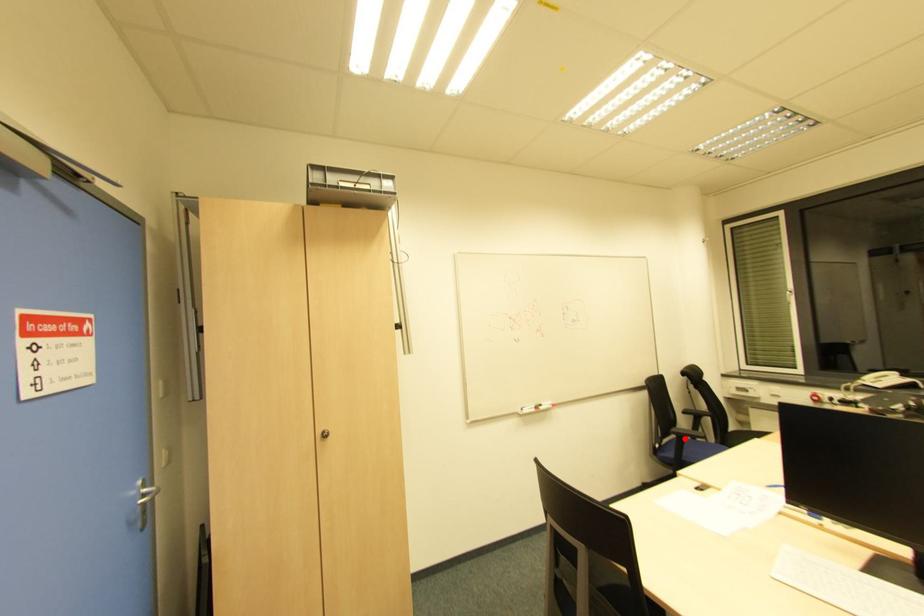
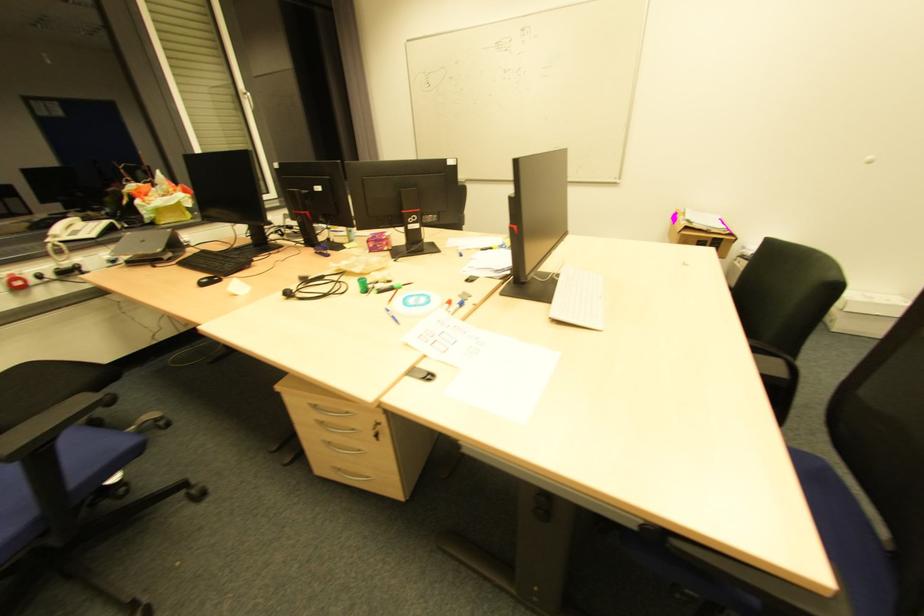
Question: I am providing you with two images of the same scene from different viewpoints. A red point is shown in image1. For the corresponding object point in image2, is it positioned nearer or farther from the camera?

Choices:
 (A) Nearer
 (B) Farther

Answer: (A)